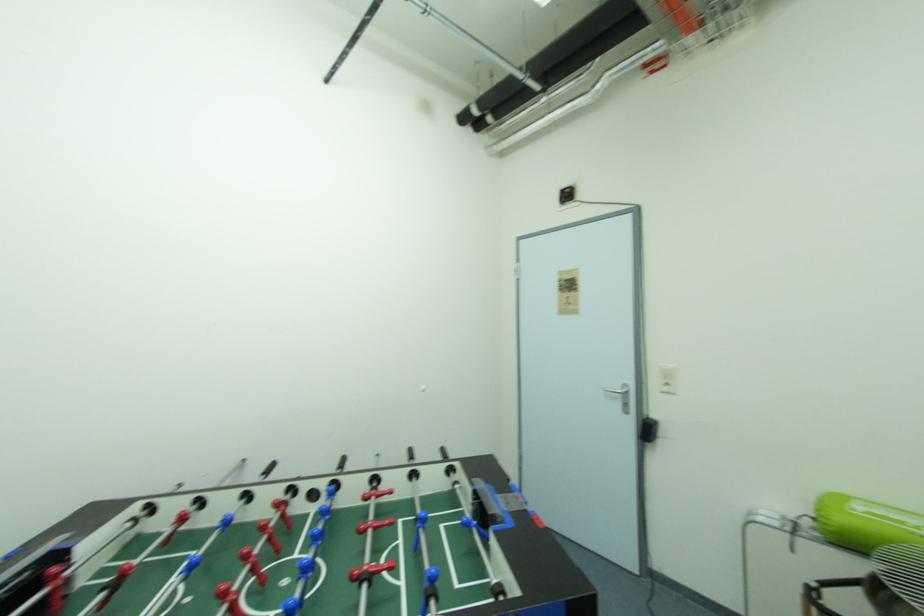
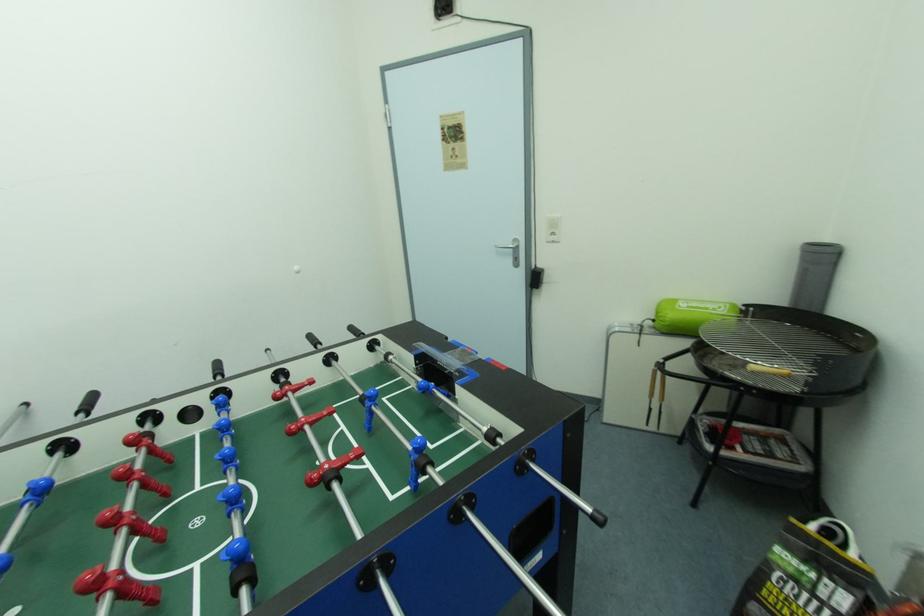
The first image is from the beginning of the video and the second image is from the end. How did the camera likely rotate when shooting the video?

The camera's rotation is toward right-down.